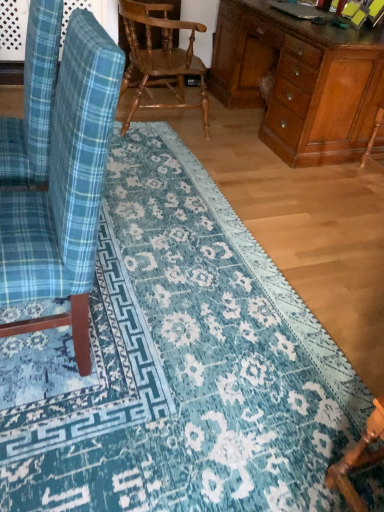
Question: Would you say wooden chair at lower right, the third chair in the top-to-bottom sequence, is inside or outside blue plaid fabric chair at left, the second chair in the top-to-bottom sequence?

Choices:
 (A) outside
 (B) inside

Answer: (A)

Question: From a real-world perspective, is wooden chair at lower right, which is the 2th chair in back-to-front order, positioned above or below blue plaid fabric chair at left, which is the first chair from front to back?

Choices:
 (A) below
 (B) above

Answer: (A)

Question: Estimate the real-world distances between objects in this image. Which object is farther from the wooden chair at lower right, placed as the 2th chair when sorted from front to back?

Choices:
 (A) blue plaid fabric chair at left, which is the first chair from front to back
 (B) wooden textured chair at center, which ranks as the 3th chair in front-to-back order
 (C) wooden desk at right
 (D) wooden armchair at right

Answer: (B)

Question: Which object is positioned closest to the wooden chair at lower right, placed as the 2th chair when sorted from front to back?

Choices:
 (A) blue plaid fabric chair at left, the 3th chair in the back-to-front sequence
 (B) wooden armchair at right
 (C) wooden textured chair at center, positioned as the first chair in top-to-bottom order
 (D) wooden desk at right

Answer: (A)